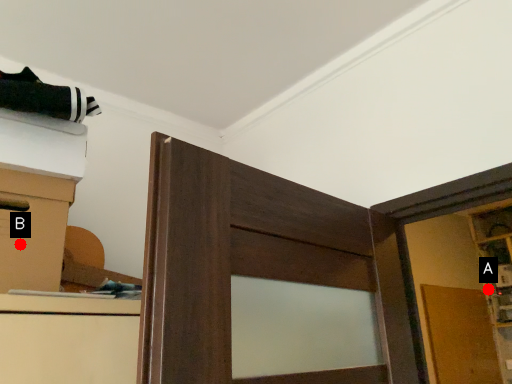
Question: Two points are circled on the image, labeled by A and B beside each circle. Among these points, which one is farthest from the camera?

Choices:
 (A) A is further
 (B) B is further

Answer: (A)